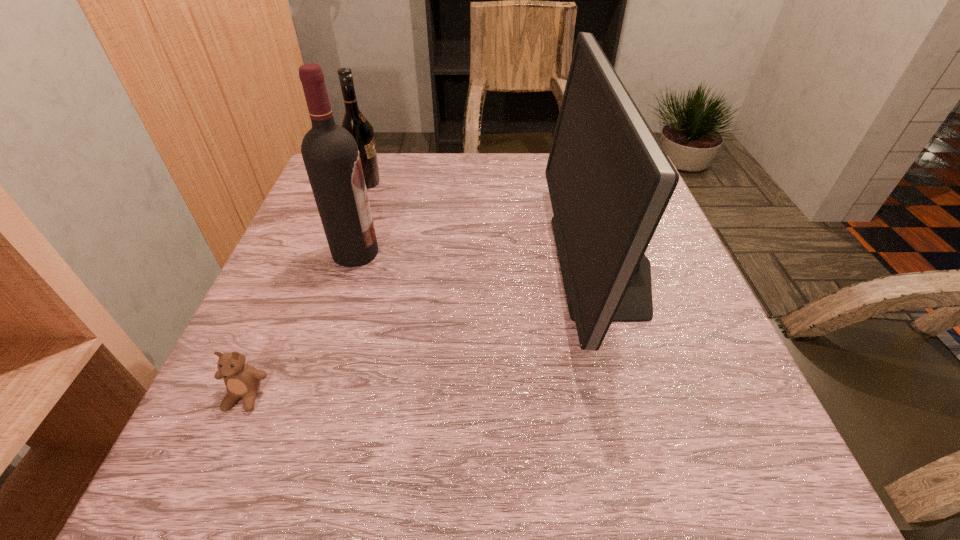
This screenshot has width=960, height=540. Find the location of `vacant space situated 0.310m on the label of the shorter wine bottle`. vacant space situated 0.310m on the label of the shorter wine bottle is located at coordinates (501, 183).

The image size is (960, 540). What are the coordinates of `vacant space located 0.050m on the front-facing side of the shortest object` in the screenshot? It's located at (224, 446).

In order to click on computer monitor at the far edge in this screenshot , I will do `click(609, 180)`.

Locate an element on the screen. wine bottle located at the far edge is located at coordinates (353, 121).

The height and width of the screenshot is (540, 960). Identify the location of teddy bear that is at the left edge. pyautogui.click(x=242, y=380).

Where is `object located in the right edge section of the desktop`? This screenshot has height=540, width=960. object located in the right edge section of the desktop is located at coordinates click(x=609, y=180).

Find the location of `object located in the far left corner section of the desktop`. object located in the far left corner section of the desktop is located at coordinates (353, 121).

Where is `object located in the far right corner section of the desktop`? object located in the far right corner section of the desktop is located at coordinates (609, 180).

In the image, there is a desktop. Identify the location of free region at the far edge. (452, 191).

Find the location of a particular element. Image resolution: width=960 pixels, height=540 pixels. free location at the near edge is located at coordinates (298, 488).